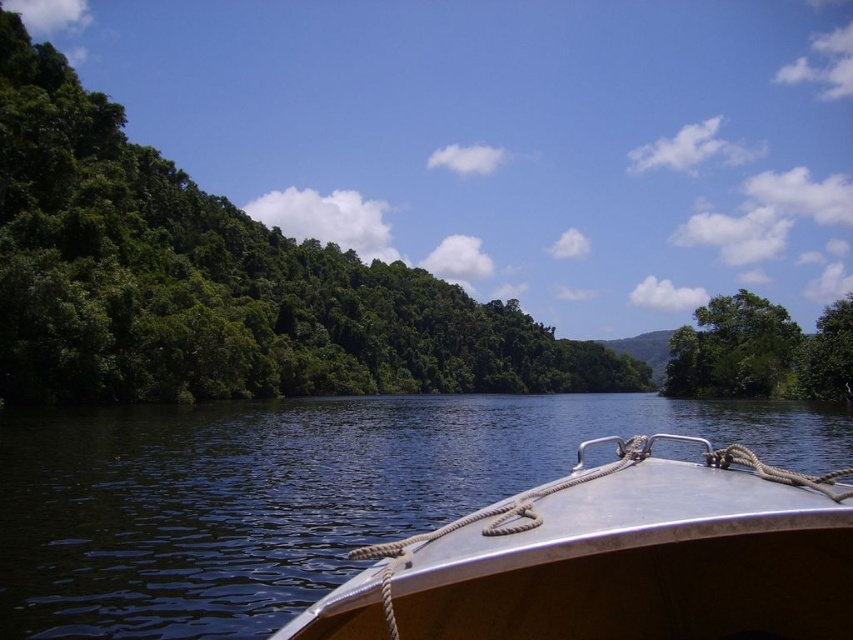
You are on a boat and looking at the green leafy trees at left and the green leafy tree at right. Which one appears bigger?

The green leafy trees at left appears bigger than the green leafy tree at right.

You are on a boat and looking at the green leafy trees at left and the green leafy tree at right. Which one is located more to the left side?

The green leafy trees at left is more on the left side than the green leafy tree at right.